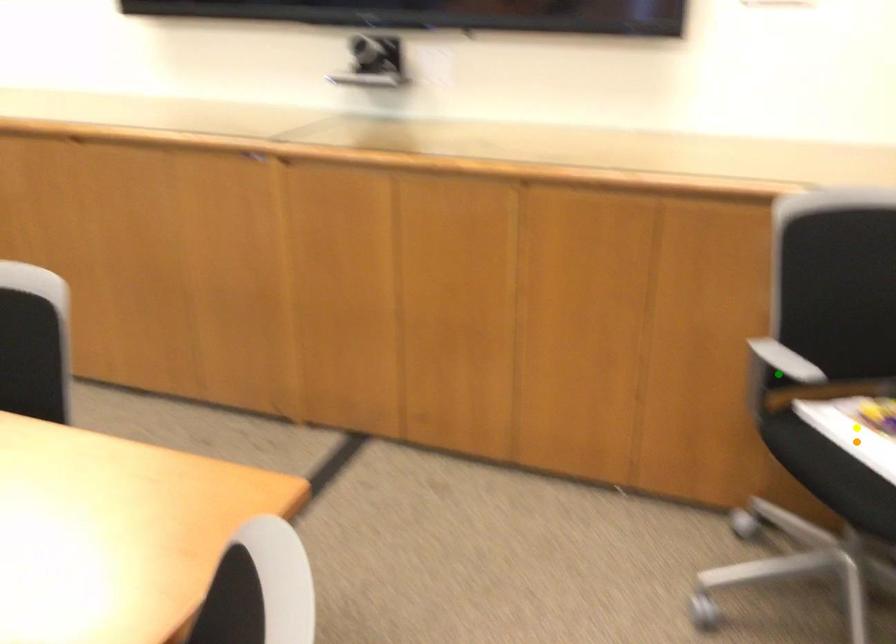
Order these from nearest to farthest:
1. yellow point
2. green point
3. orange point

1. yellow point
2. orange point
3. green point